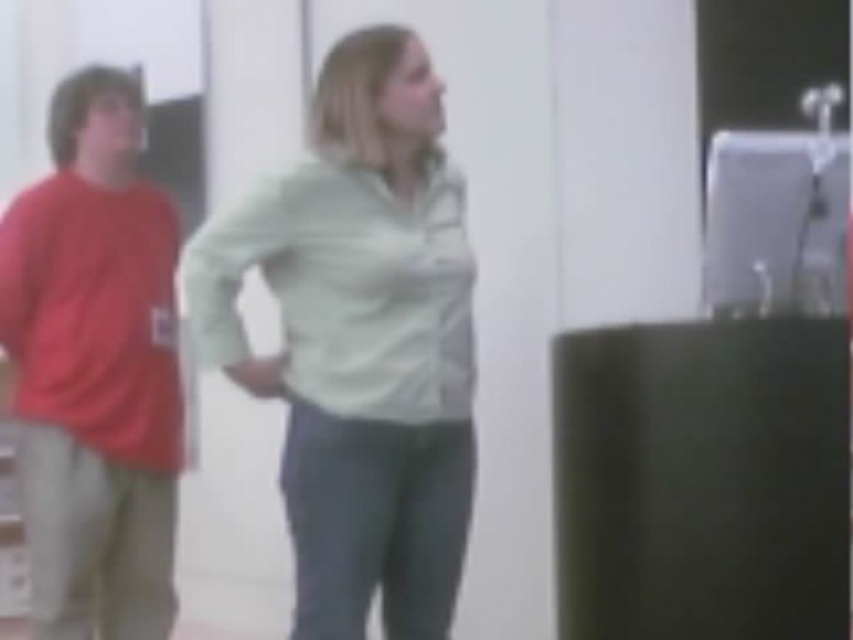
In the scene shown: Is matte red shirt at left to the right of light green cotton shirt at center from the viewer's perspective?

In fact, matte red shirt at left is to the left of light green cotton shirt at center.

Is matte red shirt at left shorter than light green cotton shirt at center?

In fact, matte red shirt at left may be taller than light green cotton shirt at center.

Who is more forward, (103, 115) or (352, 356)?

Positioned in front is point (352, 356).

I want to click on matte red shirt at left, so click(96, 369).

Is light green fabric shirt at center taller than matte red shirt at left?

No, light green fabric shirt at center is not taller than matte red shirt at left.

Which is more to the right, light green fabric shirt at center or matte red shirt at left?

light green fabric shirt at center is more to the right.

At what (x,y) coordinates should I click in order to perform the action: click on light green fabric shirt at center. Please return your answer as a coordinate pair (x, y). Looking at the image, I should click on (358, 340).

Who is taller, light green fabric shirt at center or light green cotton shirt at center?

With more height is light green fabric shirt at center.

How distant is light green fabric shirt at center from light green cotton shirt at center?

light green fabric shirt at center and light green cotton shirt at center are 2.33 inches apart from each other.

Describe the element at coordinates (358, 340) in the screenshot. I see `light green fabric shirt at center` at that location.

At what (x,y) coordinates should I click in order to perform the action: click on light green fabric shirt at center. Please return your answer as a coordinate pair (x, y). This screenshot has height=640, width=853. Looking at the image, I should click on (358, 340).